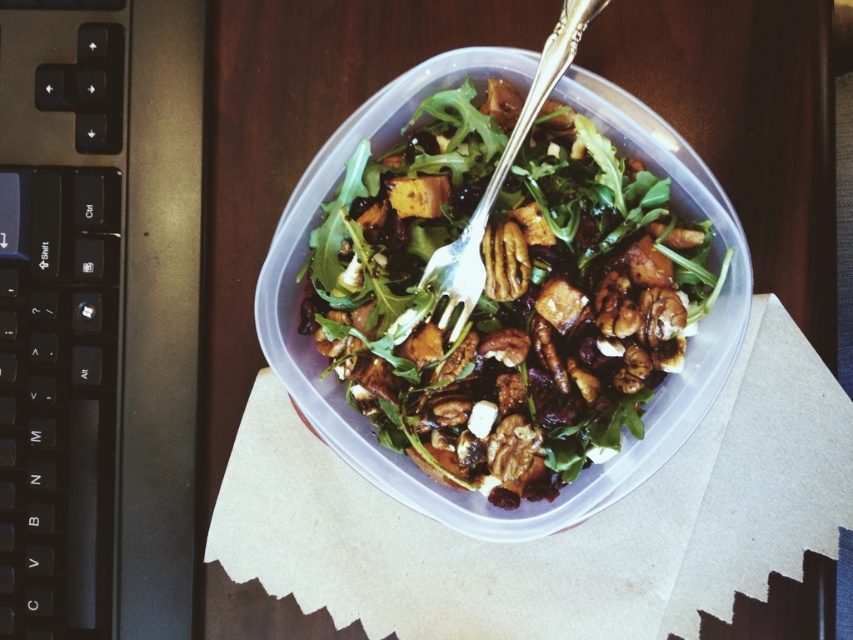
Is green leafymaterial/textureobject at upper center thinner than silver metallic fork at center?

Incorrect, green leafymaterial/textureobject at upper center's width is not less than silver metallic fork at center's.

Is green leafymaterial/textureobject at upper center above silver metallic fork at center?

Incorrect, green leafymaterial/textureobject at upper center is not positioned above silver metallic fork at center.

Which is in front, point (421, 145) or point (434, 316)?

Point (434, 316)

This screenshot has width=853, height=640. I want to click on green leafymaterial/textureobject at upper center, so click(508, 292).